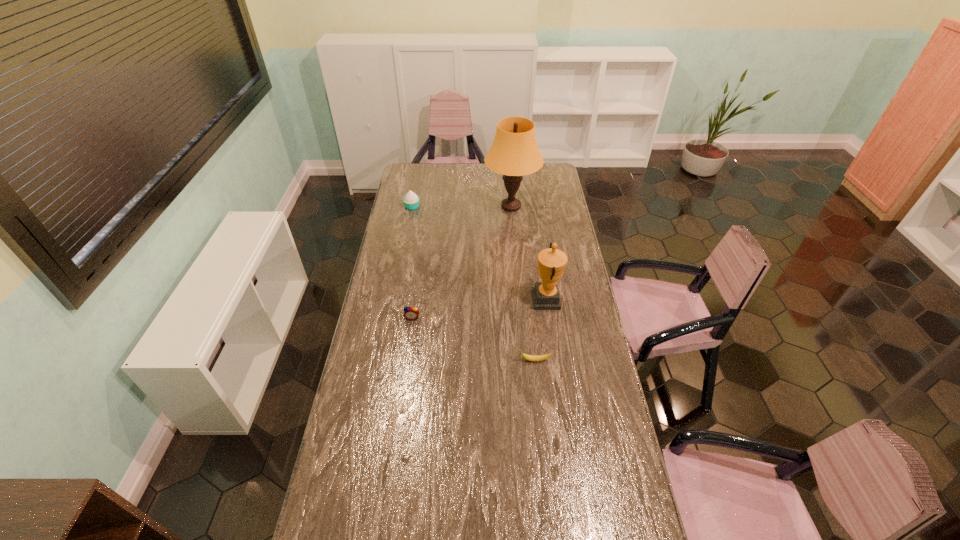
Where is `lampshade`? The width and height of the screenshot is (960, 540). lampshade is located at coordinates (514, 152).

Find the location of `the third farthest object`. the third farthest object is located at coordinates (551, 262).

Identify the location of the second tallest object. Image resolution: width=960 pixels, height=540 pixels. (551, 262).

Identify the location of the third shortest object. The height and width of the screenshot is (540, 960). (411, 201).

Image resolution: width=960 pixels, height=540 pixels. I want to click on the leftmost object, so click(x=411, y=201).

The width and height of the screenshot is (960, 540). I want to click on the fourth farthest object, so click(411, 313).

At what (x,y) coordinates should I click in order to perform the action: click on the fourth object from right to left. Please return your answer as a coordinate pair (x, y). The height and width of the screenshot is (540, 960). Looking at the image, I should click on (411, 313).

Image resolution: width=960 pixels, height=540 pixels. I want to click on the nearest object, so click(534, 358).

Find the location of a particular element. The height and width of the screenshot is (540, 960). banana is located at coordinates (534, 358).

Where is `vacant area located 0.190m on the front of the tallest object`? The image size is (960, 540). vacant area located 0.190m on the front of the tallest object is located at coordinates (515, 246).